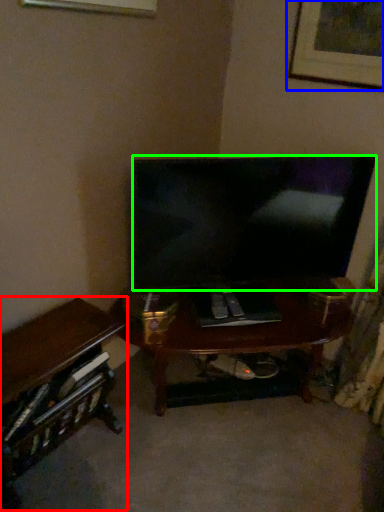
Question: Which is farther away from desk (highlighted by a red box)? picture frame (highlighted by a blue box) or television (highlighted by a green box)?

Choices:
 (A) picture frame
 (B) television

Answer: (A)